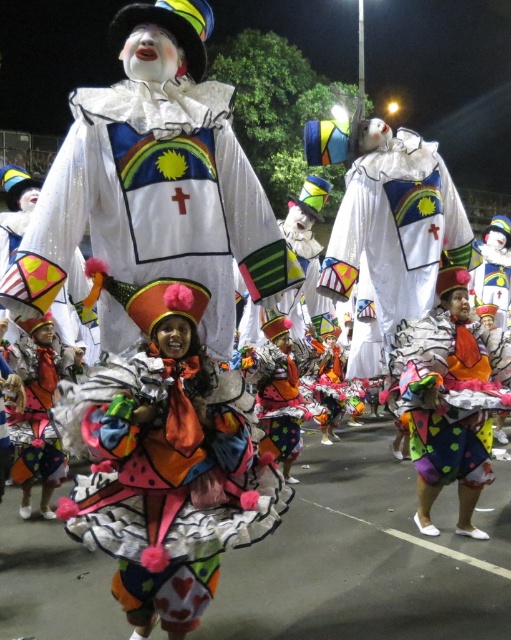
Question: Is white matte clown at center to the left of multicolored fabric clown at center from the viewer's perspective?

Choices:
 (A) yes
 (B) no

Answer: (A)

Question: Which object is the closest to the multicolored fabric doll at center?

Choices:
 (A) white matte clown at center
 (B) multicolored fabric clown at center

Answer: (A)

Question: Where is multicolored fabric dress at center located in relation to multicolored fabric doll at center in the image?

Choices:
 (A) right
 (B) left

Answer: (A)

Question: Does white matte clown at center have a smaller size compared to multicolored fabric clown at center?

Choices:
 (A) no
 (B) yes

Answer: (A)

Question: Which object is farther from the camera taking this photo?

Choices:
 (A) white glittery clown at center
 (B) multicolored fabric dress at center
 (C) white matte clown at center
 (D) multicolored fabric doll at center

Answer: (D)

Question: Which point is closer to the camera taking this photo?

Choices:
 (A) (44, 468)
 (B) (230, 221)

Answer: (B)